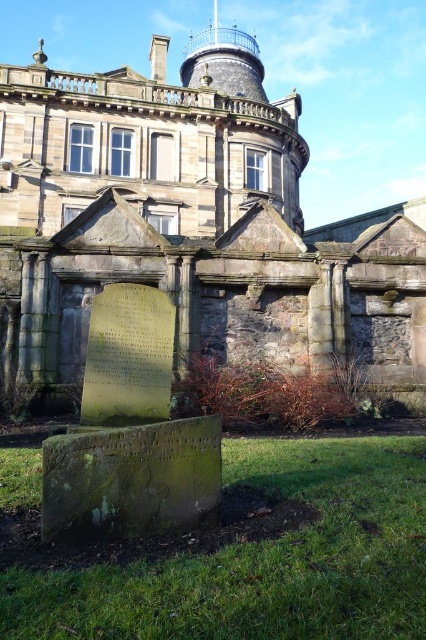
You are standing at the center of the image and want to locate the green mossy stone monument at lower left. According to the coordinates provided, in which direction should you move to face it?

The green mossy stone monument at lower left is located at coordinates point (x=129, y=433). Since you are at the center, you should move to the left and downward to face it.